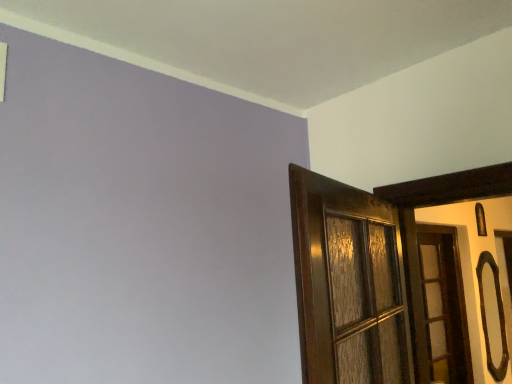
What do you see at coordinates (444, 305) in the screenshot? I see `wooden door at right` at bounding box center [444, 305].

Find the location of a particular element. This screenshot has width=512, height=384. wooden door at right is located at coordinates (444, 305).

Find the location of a particular element. This screenshot has width=512, height=384. black glossy door handle at right is located at coordinates (499, 317).

What do you see at coordinates (499, 317) in the screenshot? This screenshot has width=512, height=384. I see `black glossy door handle at right` at bounding box center [499, 317].

Image resolution: width=512 pixels, height=384 pixels. Find the location of `wooden door at right`. wooden door at right is located at coordinates (444, 305).

From the picture: Considering the relative positions of wooden door at right and black glossy door handle at right in the image provided, is wooden door at right to the right of black glossy door handle at right from the viewer's perspective?

No.

Relative to black glossy door handle at right, is wooden door at right in front or behind?

Visually, wooden door at right is located in front of black glossy door handle at right.

Does point (423, 232) appear closer or farther from the camera than point (488, 363)?

Point (423, 232) is closer to the camera than point (488, 363).

Looking at this image, from the image's perspective, between wooden door at right and black glossy door handle at right, who is located below?

black glossy door handle at right.

From a real-world perspective, who is located higher, wooden door at right or black glossy door handle at right?

wooden door at right is physically above.

In terms of width, does wooden door at right look wider or thinner when compared to black glossy door handle at right?

Clearly, wooden door at right has more width compared to black glossy door handle at right.

Looking at this image, does wooden door at right have a lesser height compared to black glossy door handle at right?

Incorrect, the height of wooden door at right does not fall short of that of black glossy door handle at right.

Can you confirm if wooden door at right is bigger than black glossy door handle at right?

Correct, wooden door at right is larger in size than black glossy door handle at right.

Is wooden door at right outside of black glossy door handle at right?

Yes.

Would you say wooden door at right is a long distance from black glossy door handle at right?

No, wooden door at right is not far away from black glossy door handle at right.

Is wooden door at right facing towards black glossy door handle at right?

No, wooden door at right is not aimed at black glossy door handle at right.

How many degrees apart are the facing directions of wooden door at right and black glossy door handle at right?

The angle between the facing direction of wooden door at right and the facing direction of black glossy door handle at right is 2.37 degrees.

This screenshot has width=512, height=384. Identify the location of door on the left of the black glossy door handle at right. (444, 305).

Which object is positioned more to the right, black glossy door handle at right or wooden door at right?

From the viewer's perspective, black glossy door handle at right appears more on the right side.

Between black glossy door handle at right and wooden door at right, which one is positioned behind?

black glossy door handle at right is further from the camera.

Does point (487, 333) come in front of point (464, 314)?

No, it is not.

From the image's perspective, is black glossy door handle at right on wooden door at right?

No, from the image's perspective, black glossy door handle at right is not on top of wooden door at right.

From a real-world perspective, between black glossy door handle at right and wooden door at right, who is vertically lower?

black glossy door handle at right is physically lower.

Considering the relative sizes of black glossy door handle at right and wooden door at right in the image provided, is black glossy door handle at right thinner than wooden door at right?

Yes.

Looking at this image, from their relative heights in the image, would you say black glossy door handle at right is taller or shorter than wooden door at right?

Considering their sizes, black glossy door handle at right has less height than wooden door at right.

Between black glossy door handle at right and wooden door at right, which one has smaller size?

Smaller between the two is black glossy door handle at right.

Choose the correct answer: Is black glossy door handle at right inside wooden door at right or outside it?

black glossy door handle at right is not enclosed by wooden door at right.

Is black glossy door handle at right directly adjacent to wooden door at right?

They are not placed beside each other.

Is black glossy door handle at right oriented away from wooden door at right?

No, black glossy door handle at right is not facing away from wooden door at right.

Locate an element on the screen. This screenshot has width=512, height=384. door handle that appears behind the wooden door at right is located at coordinates (499, 317).

The image size is (512, 384). Identify the location of door handle behind the wooden door at right. (499, 317).

This screenshot has height=384, width=512. I want to click on door handle below the wooden door at right (from a real-world perspective), so click(499, 317).